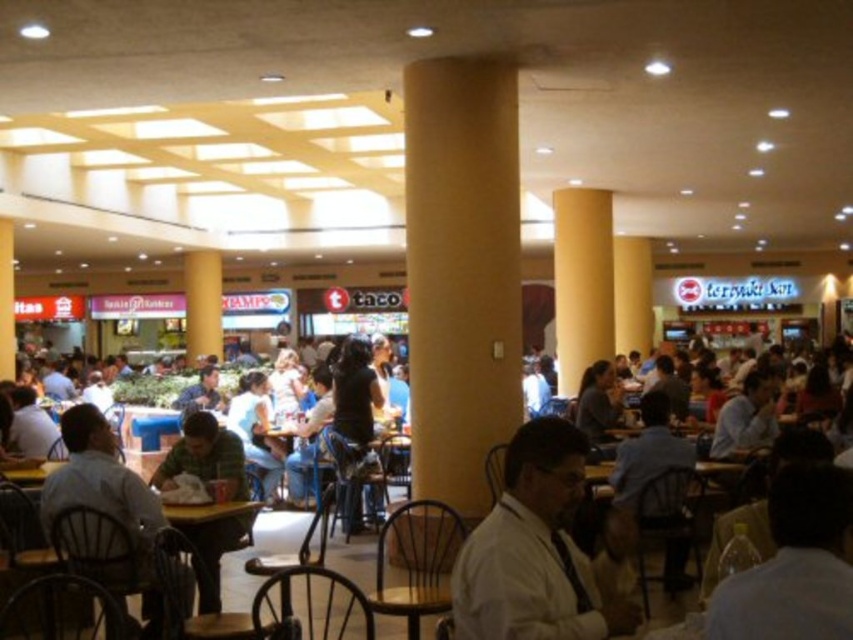
Question: Estimate the real-world distances between objects in this image. Which object is farther from the white fabric shirt at lower right?

Choices:
 (A) dark brown leather jacket at center
 (B) green matte shirt at lower left

Answer: (A)

Question: Which object is farther from the camera taking this photo?

Choices:
 (A) white shirt at center
 (B) yellow matte column at center
 (C) light brown wooden chair at lower left
 (D) dark brown leather jacket at center

Answer: (D)

Question: Is light brown wooden chair at lower left above dark brown leather jacket at center?

Choices:
 (A) yes
 (B) no

Answer: (B)

Question: Can you confirm if yellow matte column at center is thinner than white shirt at center?

Choices:
 (A) no
 (B) yes

Answer: (A)

Question: Among these objects, which one is nearest to the camera?

Choices:
 (A) yellow matte column at center
 (B) white fabric shirt at lower right
 (C) dark brown leather jacket at center

Answer: (B)

Question: Is white shirt at center smaller than white fabric shirt at lower right?

Choices:
 (A) no
 (B) yes

Answer: (A)